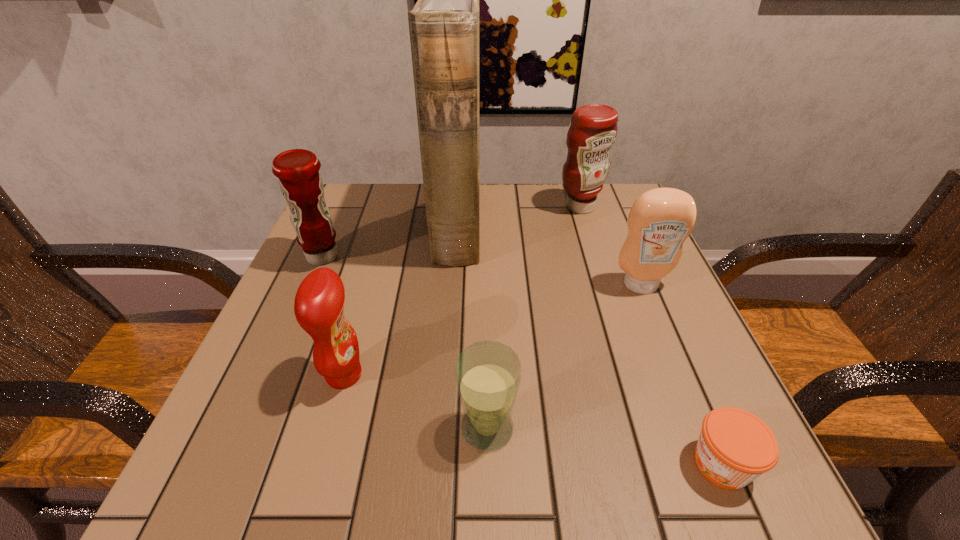
The height and width of the screenshot is (540, 960). Find the location of `vacant region located on the left of the farthest condiment`. vacant region located on the left of the farthest condiment is located at coordinates (490, 207).

Image resolution: width=960 pixels, height=540 pixels. Find the location of `vacant point located 0.330m on the right of the leftmost object`. vacant point located 0.330m on the right of the leftmost object is located at coordinates (495, 256).

This screenshot has width=960, height=540. Identify the location of free point located on the label of the second nearest condiment. (709, 452).

This screenshot has width=960, height=540. What are the coordinates of `vacant space positioned on the label side of the third condiment from right to left` in the screenshot? It's located at (462, 375).

You are a GUI agent. You are given a task and a screenshot of the screen. Output one action in this format:
    pyautogui.click(x=<x>, y=<y>)
    Task: Click on the vacant region located on the right of the sixth tallest object
    The image size is (960, 540).
    Given the screenshot: What is the action you would take?
    pyautogui.click(x=720, y=428)

Find the location of `vacant area located 0.360m on the front label of the jam`. vacant area located 0.360m on the front label of the jam is located at coordinates (429, 463).

Find the location of `vacant area situated on the front label of the jam`. vacant area situated on the front label of the jam is located at coordinates (595, 463).

You are a GUI agent. You are given a task and a screenshot of the screen. Output one action in this format:
    pyautogui.click(x=<x>, y=<y>)
    Task: Click on the vacant space located 0.380m on the front label of the jam
    This screenshot has height=540, width=960.
    Given the screenshot: What is the action you would take?
    pyautogui.click(x=415, y=463)

I want to click on phonebook that is at the far edge, so click(444, 24).

I want to click on condiment positioned at the far edge, so click(x=593, y=129).